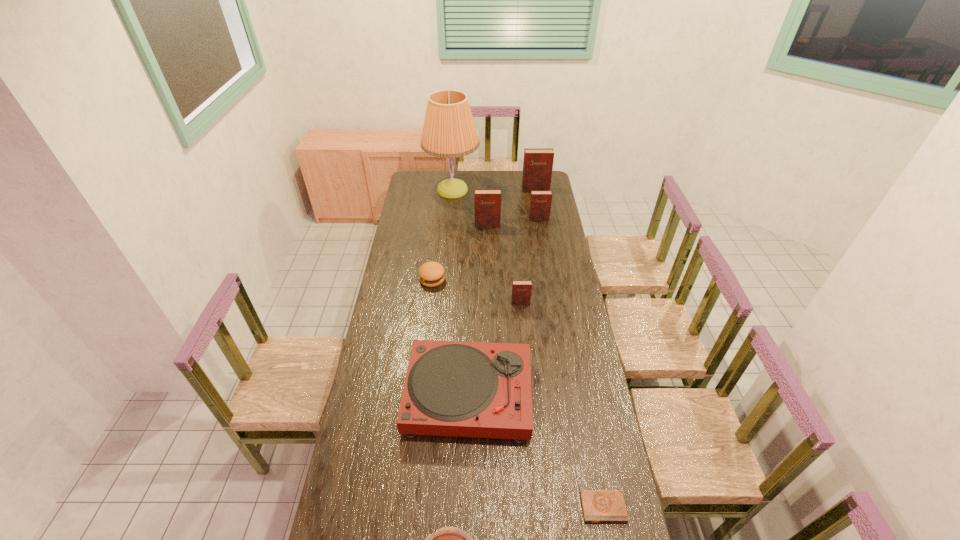
You are a GUI agent. You are given a task and a screenshot of the screen. Output one action in this format:
    pyautogui.click(x=<x>, y=<y>)
    Task: Click on the vacant space located on the front cover of the smallest reddish-brown diary
    The image size is (960, 540).
    Given the screenshot: What is the action you would take?
    click(526, 362)

Identify the location of vacant region located 0.090m on the left of the seventh farthest object. The height and width of the screenshot is (540, 960). (382, 395).

This screenshot has width=960, height=540. I want to click on vacant space located on the front of the third shortest object, so click(430, 300).

Where is `lamp located in the far edge section of the desktop`? lamp located in the far edge section of the desktop is located at coordinates (449, 131).

The width and height of the screenshot is (960, 540). I want to click on diary positioned at the far edge, so click(538, 162).

This screenshot has width=960, height=540. I want to click on lamp located at the left edge, so click(449, 131).

The width and height of the screenshot is (960, 540). In order to click on hamburger that is at the left edge in this screenshot , I will do `click(431, 274)`.

Locate an element on the screen. The image size is (960, 540). object present at the far left corner is located at coordinates (449, 131).

The width and height of the screenshot is (960, 540). Find the location of `object situated at the far right corner`. object situated at the far right corner is located at coordinates (538, 162).

Image resolution: width=960 pixels, height=540 pixels. Find the location of `vacant area at the far edge of the desktop`. vacant area at the far edge of the desktop is located at coordinates (496, 188).